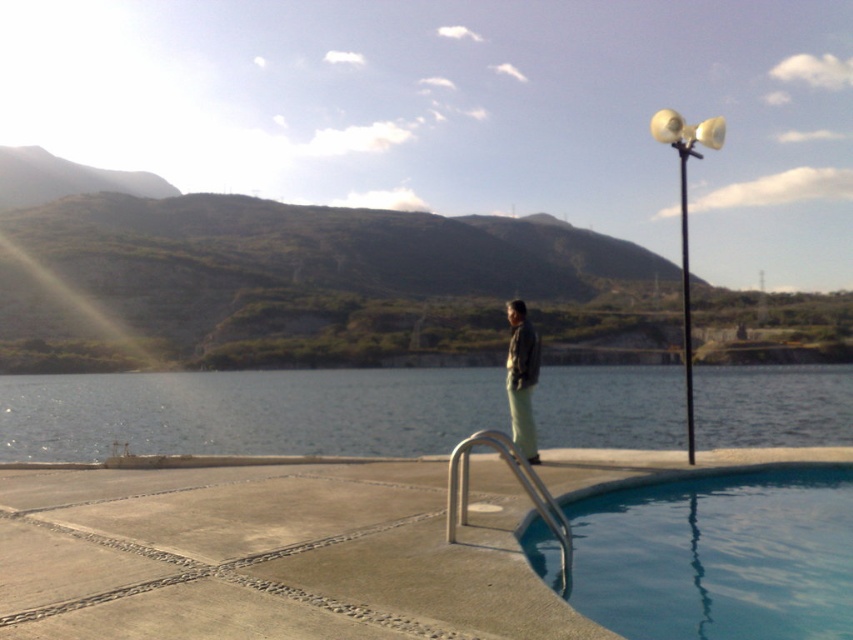
Is clear water at pool right further to camera compared to matte black jacket at center?

Yes, clear water at pool right is behind matte black jacket at center.

Which is more to the left, clear water at pool right or matte black jacket at center?

matte black jacket at center

Between point (146, 429) and point (514, 362), which one is positioned in front?

Positioned in front is point (514, 362).

Locate an element on the screen. The image size is (853, 640). clear water at pool right is located at coordinates (247, 412).

Between blue smooth water at lower right and matte black jacket at center, which one appears on the left side from the viewer's perspective?

matte black jacket at center

Between point (585, 589) and point (523, 384), which one is positioned in front?

Point (585, 589) is in front.

Locate an element on the screen. blue smooth water at lower right is located at coordinates (718, 556).

Identify the location of silver metallic rail at lower center. (518, 483).

What do you see at coordinates (518, 483) in the screenshot?
I see `silver metallic rail at lower center` at bounding box center [518, 483].

Where is `silver metallic rail at lower center`? silver metallic rail at lower center is located at coordinates (518, 483).